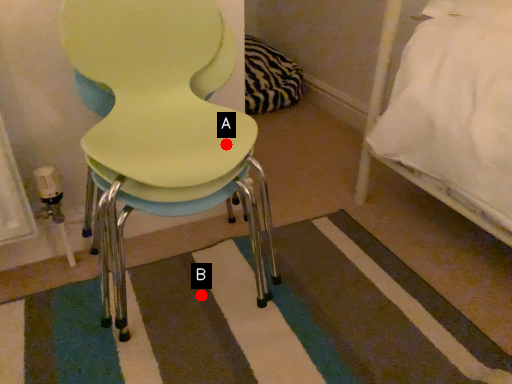
Question: Two points are circled on the image, labeled by A and B beside each circle. Which of the following is the closest to the observer?

Choices:
 (A) A is closer
 (B) B is closer

Answer: (A)